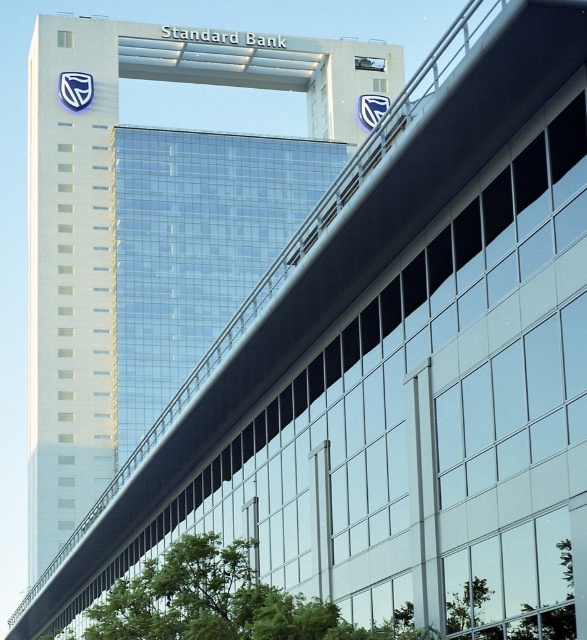
Question: Is glassy blue skyscraper at upper center further to camera compared to transparent glass building at center?

Choices:
 (A) yes
 (B) no

Answer: (B)

Question: Which point is closer to the camera?

Choices:
 (A) (156, 147)
 (B) (332, 128)

Answer: (A)

Question: Is glassy blue skyscraper at upper center further to the viewer compared to transparent glass building at center?

Choices:
 (A) no
 (B) yes

Answer: (A)

Question: Among these objects, which one is farthest from the camera?

Choices:
 (A) transparent glass building at center
 (B) glassy blue skyscraper at upper center

Answer: (A)

Question: Where is glassy blue skyscraper at upper center located in relation to transparent glass building at center in the image?

Choices:
 (A) above
 (B) below

Answer: (A)